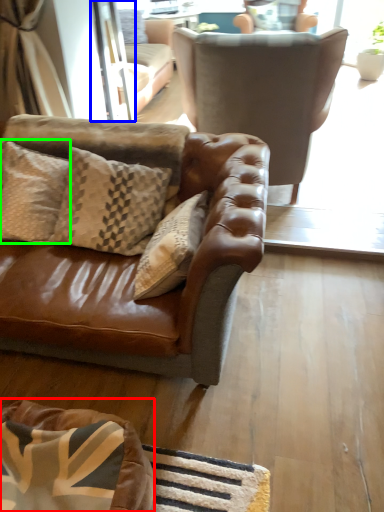
Question: Estimate the real-world distances between objects in this image. Which object is closer to dog bed (highlighted by a red box), screen door (highlighted by a blue box) or pillow (highlighted by a green box)?

Choices:
 (A) screen door
 (B) pillow

Answer: (B)